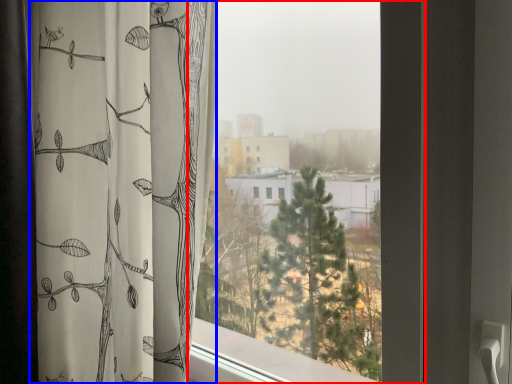
Question: Among these objects, which one is nearest to the camera, window (highlighted by a red box) or curtain (highlighted by a blue box)?

Choices:
 (A) window
 (B) curtain

Answer: (A)